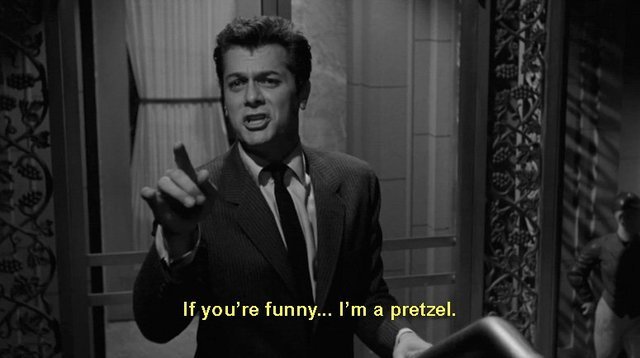
Image resolution: width=640 pixels, height=358 pixels. What are the coordinates of `window` in the screenshot? It's located at (189, 65).